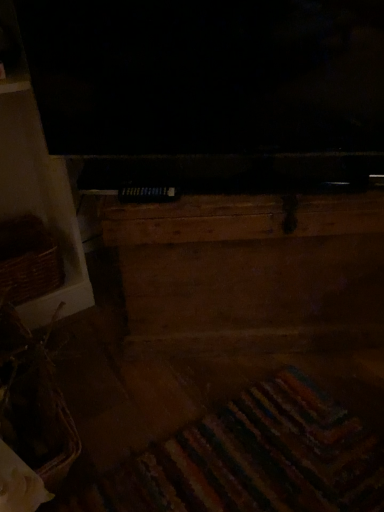
Find the location of a particular element. The width and height of the screenshot is (384, 512). free space in front of wooden chest at center is located at coordinates (247, 415).